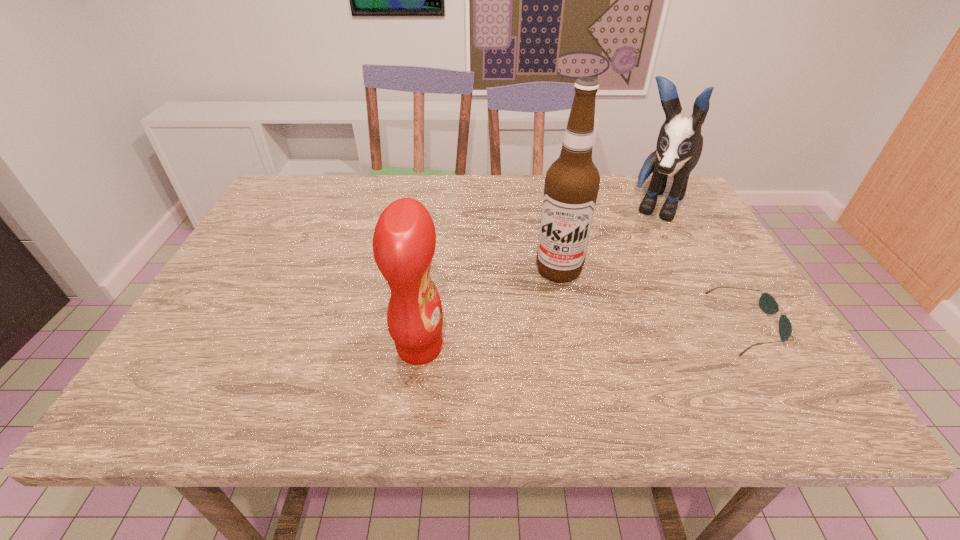
Where is `vacant region between the second tallest object and the third object from right to left`? vacant region between the second tallest object and the third object from right to left is located at coordinates 608,238.

I want to click on free space that is in between the farthest object and the leftmost object, so coord(538,276).

Locate an element on the screen. free space between the second shortest object and the shortest object is located at coordinates (583, 336).

You are a GUI agent. You are given a task and a screenshot of the screen. Output one action in this format:
    pyautogui.click(x=<x>, y=<y>)
    Task: Click on the vacant area that lies between the third nearest object and the farthest object
    
    Given the screenshot: What is the action you would take?
    pyautogui.click(x=608, y=238)

Locate an element on the screen. The image size is (960, 540). free space between the sunglasses and the farthest object is located at coordinates (701, 265).

Identify the location of free space between the leftmost object and the alcohol. (490, 309).

The image size is (960, 540). What are the coordinates of `vacant region between the puppy and the sunglasses` in the screenshot? It's located at (701, 265).

Locate which object ranks third in proximity to the shortest object. Please provide its 2D coordinates. Your answer should be formatted as a tuple, i.e. [(x, y)], where the tuple contains the x and y coordinates of a point satisfying the conditions above.

[(404, 240)]

Choose which object is the second nearest neighbor to the shortest object. Please provide its 2D coordinates. Your answer should be formatted as a tuple, i.e. [(x, y)], where the tuple contains the x and y coordinates of a point satisfying the conditions above.

[(572, 182)]

What are the coordinates of `vacant space that satisfies the following two spatial constraints: 1. on the front side of the alcohol; 2. on the lenses of the shortest object` in the screenshot? It's located at click(x=569, y=325).